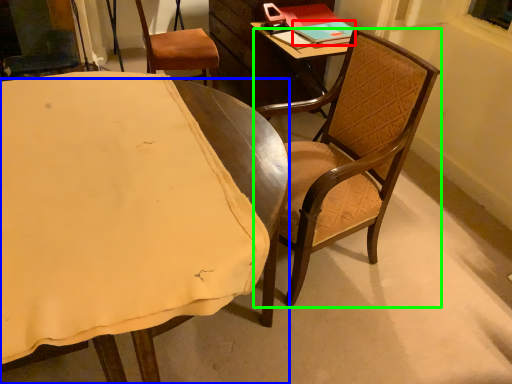
Question: Estimate the real-world distances between objects in this image. Which object is closer to book (highlighted by a red box), chair (highlighted by a blue box) or chair (highlighted by a green box)?

Choices:
 (A) chair
 (B) chair

Answer: (B)